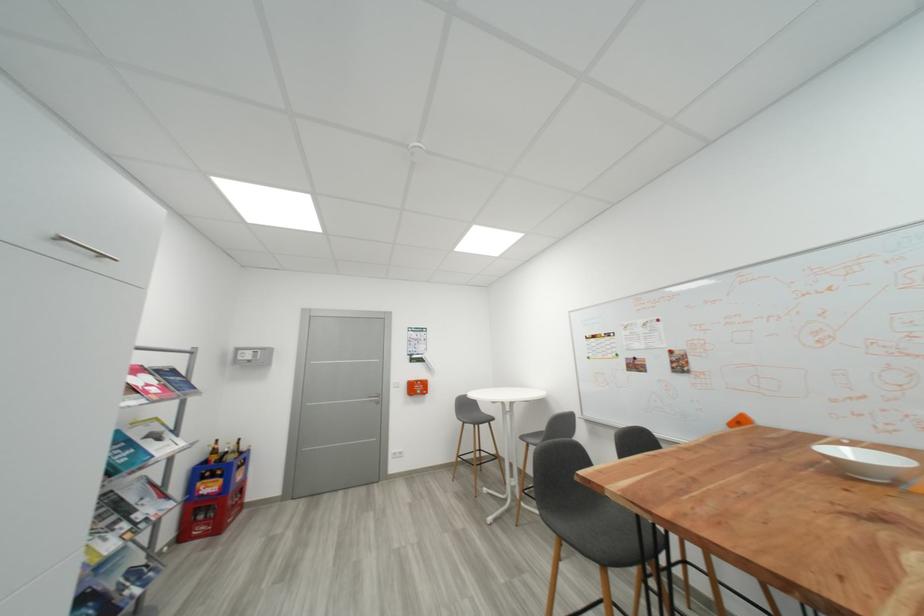
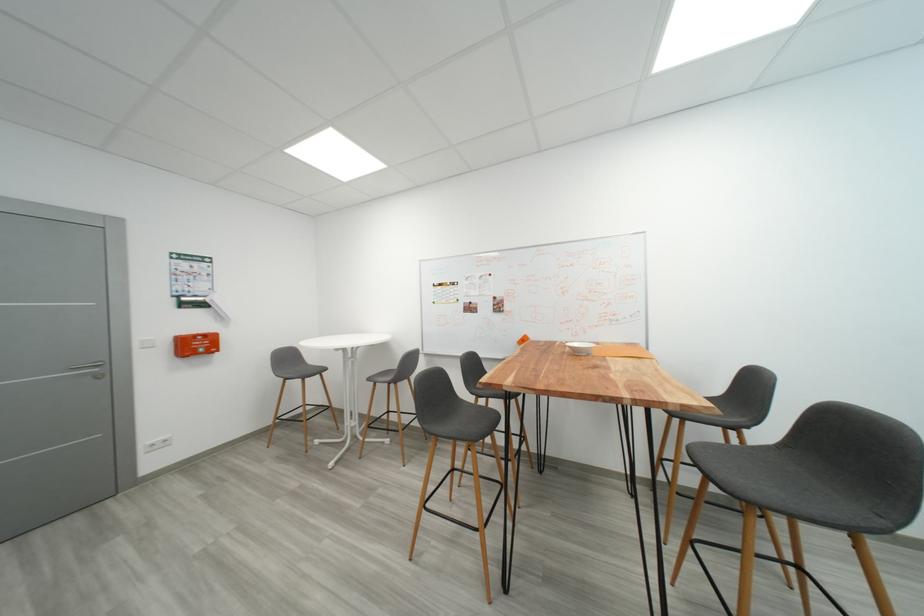
In the second image, find the point that corresponds to point 834,458 in the first image.

(578, 350)